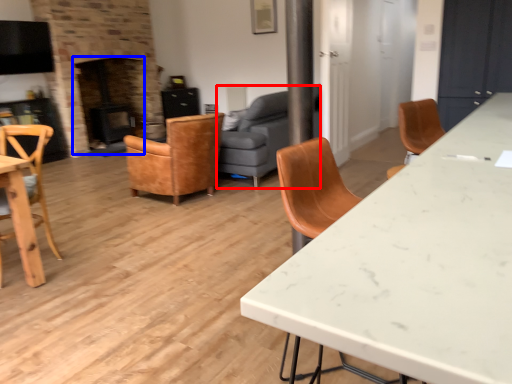
Question: Among these objects, which one is nearest to the camera, studio couch (highlighted by a red box) or fireplace (highlighted by a blue box)?

Choices:
 (A) studio couch
 (B) fireplace

Answer: (A)